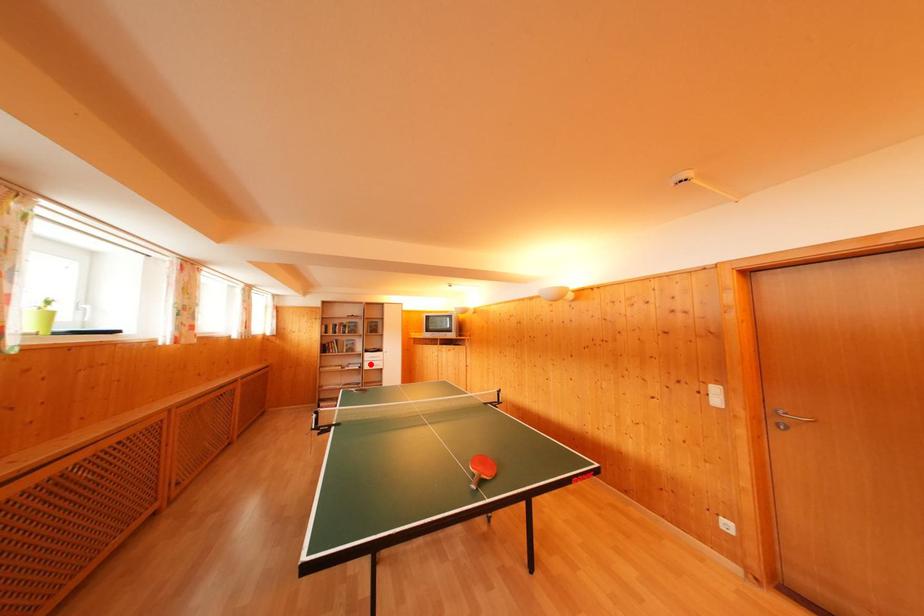
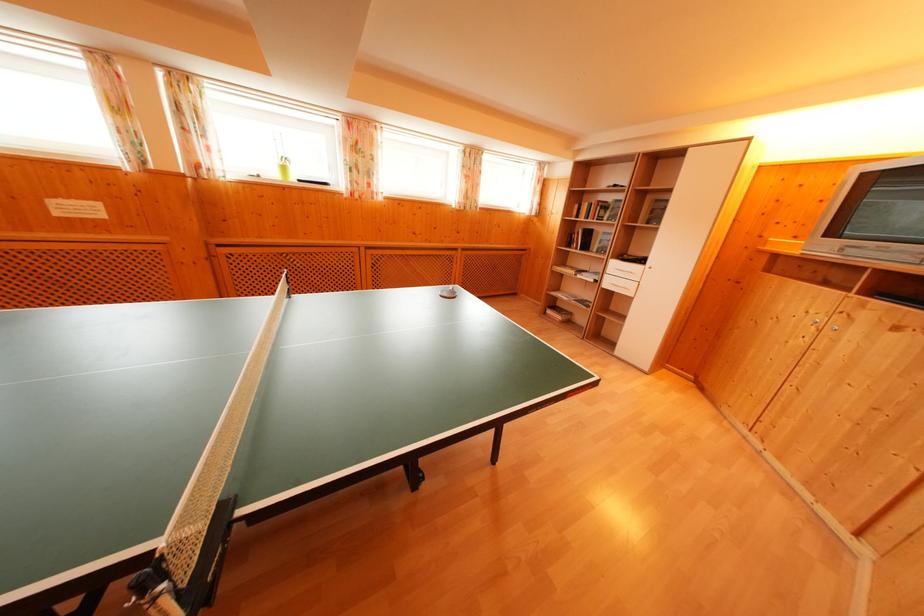
Question: I am providing you with two images of the same scene from different viewpoints. Image1 has a red point marked. In image2, the corresponding 3D location appears at what relative position? Reply with the corresponding letter.

Choices:
 (A) Closer
 (B) Farther

Answer: (A)